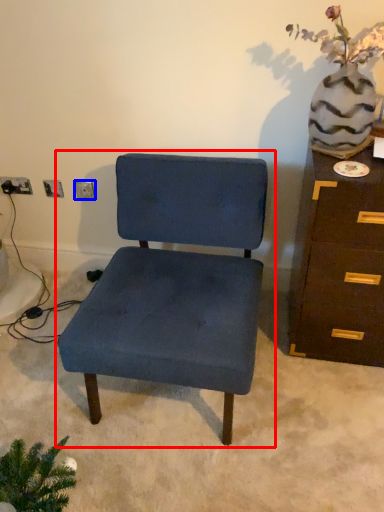
Question: Which of the following is the closest to the observer, chair (highlighted by a red box) or electric outlet (highlighted by a blue box)?

Choices:
 (A) chair
 (B) electric outlet

Answer: (A)